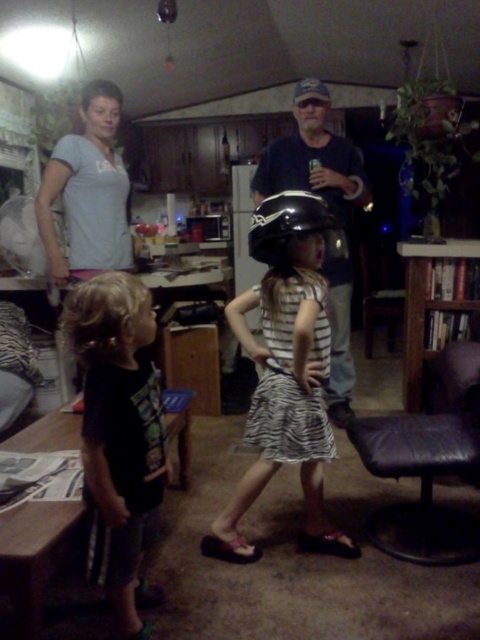
Who is more distant from viewer, (278, 388) or (97, 100)?

Point (97, 100)

Can you confirm if zebra print dress at center is positioned to the right of gray cotton shirt at upper left?

Indeed, zebra print dress at center is positioned on the right side of gray cotton shirt at upper left.

What do you see at coordinates (285, 371) in the screenshot? I see `zebra print dress at center` at bounding box center [285, 371].

Find the location of `zebra print dress at center`. zebra print dress at center is located at coordinates (285, 371).

Does zebra print dress at center lie in front of black matte helmet at center?

Yes, it is.

Between zebra print dress at center and black matte helmet at center, which one has less height?

black matte helmet at center

Between point (249, 296) and point (319, 218), which one is positioned behind?

Positioned behind is point (249, 296).

Where is `zebra print dress at center`? The height and width of the screenshot is (640, 480). zebra print dress at center is located at coordinates (285, 371).

Between point (90, 237) and point (284, 157), which one is positioned in front?

Positioned in front is point (90, 237).

Can you confirm if gray cotton shirt at upper left is positioned below dark blue denim shirt at center?

Incorrect, gray cotton shirt at upper left is not positioned below dark blue denim shirt at center.

Where is `gray cotton shirt at upper left`? The image size is (480, 640). gray cotton shirt at upper left is located at coordinates (87, 193).

Identify the location of gray cotton shirt at upper left. (87, 193).